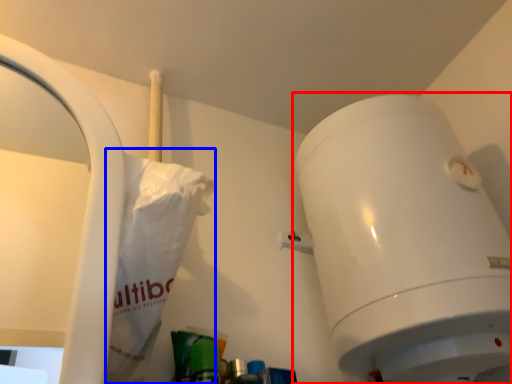
Question: Among these objects, which one is nearest to the camera, toilet (highlighted by a red box) or paper bag (highlighted by a blue box)?

Choices:
 (A) toilet
 (B) paper bag

Answer: (B)